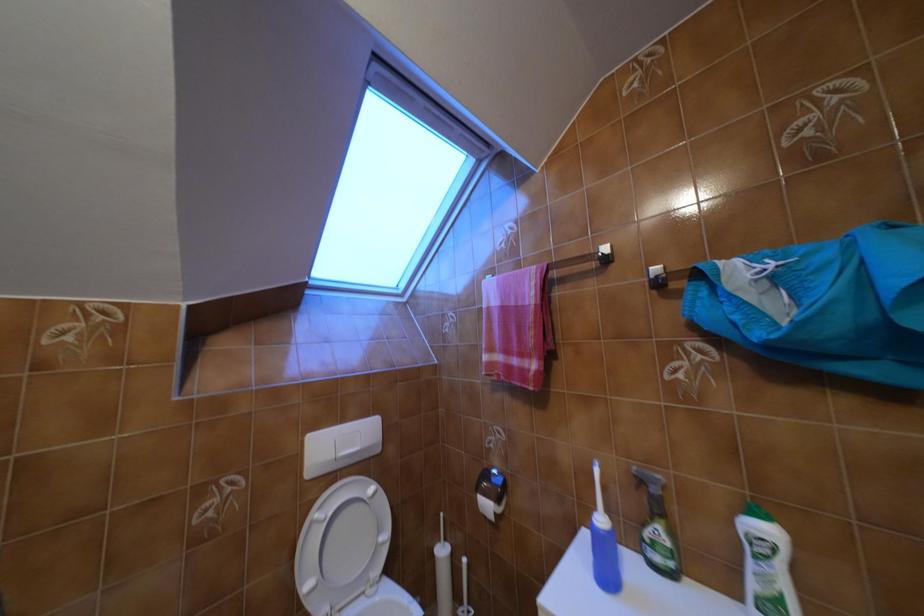
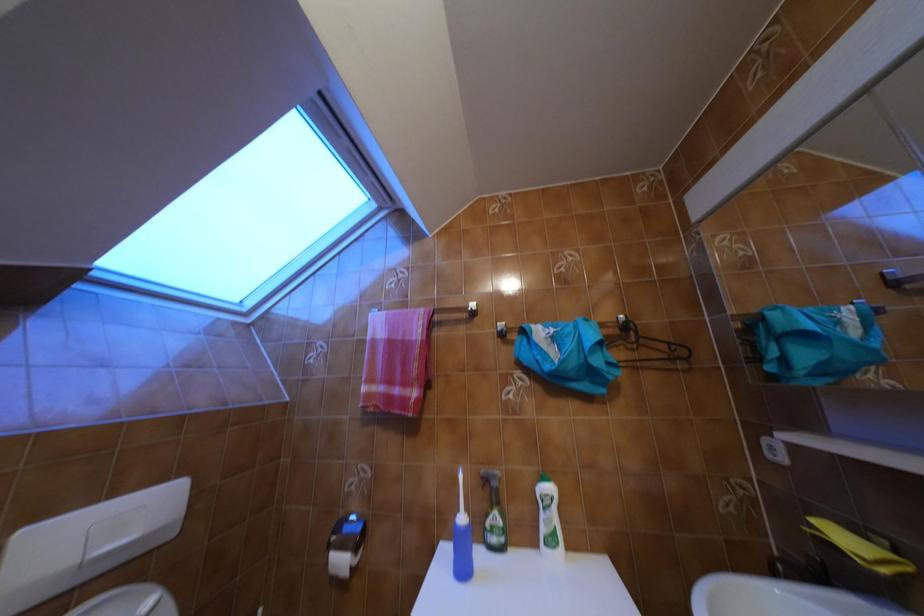
Question: How did the camera likely rotate?

Choices:
 (A) Left
 (B) Right
 (C) Up
 (D) Down

Answer: (B)